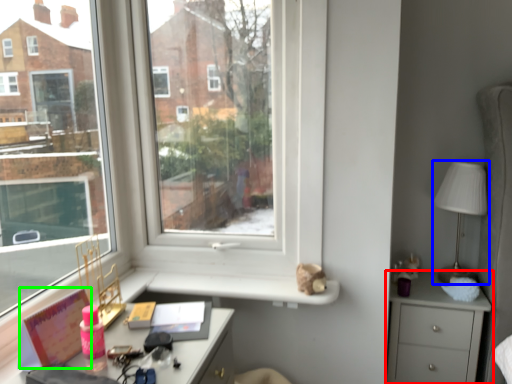
Question: Estimate the real-world distances between objects in this image. Which object is closer to chest of drawers (highlighted by a red box), table lamp (highlighted by a blue box) or book (highlighted by a green box)?

Choices:
 (A) table lamp
 (B) book

Answer: (A)